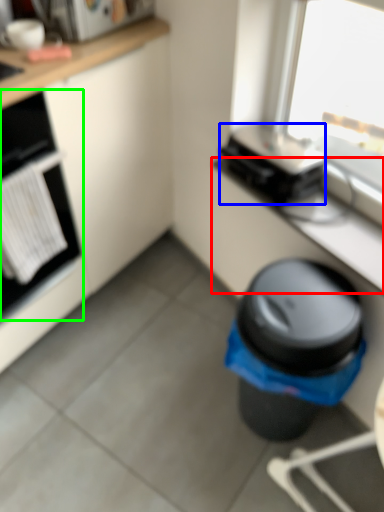
Question: Which is nearer to the counter top (highlighted by a red box)? appliance (highlighted by a blue box) or home appliance (highlighted by a green box).

Choices:
 (A) appliance
 (B) home appliance

Answer: (A)